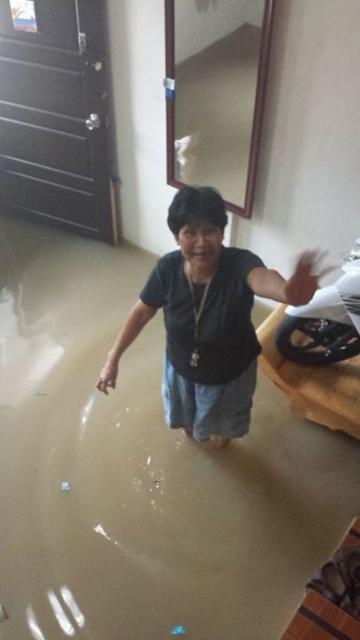
Which is more to the left, matte black shirt at center or shiny black motorcycle at center?

matte black shirt at center is more to the left.

Is matte black shirt at center to the left of shiny black motorcycle at center from the viewer's perspective?

Indeed, matte black shirt at center is positioned on the left side of shiny black motorcycle at center.

Is point (254, 352) less distant than point (330, 284)?

Yes, point (254, 352) is closer to viewer.

This screenshot has height=640, width=360. What are the coordinates of `matte black shirt at center` in the screenshot? It's located at (208, 317).

Is brown matte water at center to the right of shiny black motorcycle at center from the viewer's perspective?

In fact, brown matte water at center is to the left of shiny black motorcycle at center.

Who is higher up, brown matte water at center or shiny black motorcycle at center?

shiny black motorcycle at center is higher up.

Image resolution: width=360 pixels, height=640 pixels. I want to click on brown matte water at center, so click(141, 472).

Looking at this image, measure the distance between brown matte water at center and camera.

They are 7.15 feet apart.

Does brown matte water at center have a smaller size compared to matte black shirt at center?

Actually, brown matte water at center might be larger than matte black shirt at center.

The image size is (360, 640). I want to click on brown matte water at center, so click(x=141, y=472).